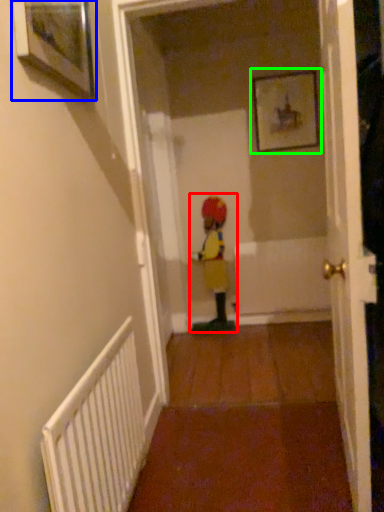
Question: Which object is the closest to the person (highlighted by a red box)? Choose among these: picture frame (highlighted by a blue box) or picture frame (highlighted by a green box).

Choices:
 (A) picture frame
 (B) picture frame

Answer: (B)